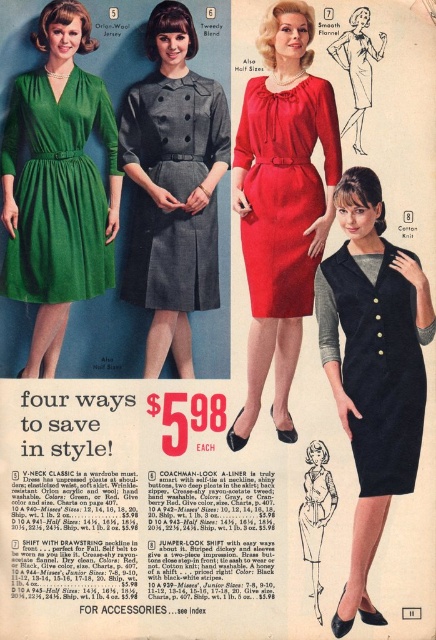
In the vintage fashion advertisement, there are two points marked at coordinates point (17,180) and point (333,506). Which point is positioned closer to the viewer?

Point (17,180) is closer to the viewer than point (333,506).

You are a fashion designer trying to decide which dress to feature in a new collection. The twilly blend wool dress at center and the black wool dress at center are both candidates. Based on their widths, which one would you choose if you want a more voluminous silhouette?

The twilly blend wool dress at center is wider than the black wool dress at center, so it would be the better choice for a more voluminous silhouette.

Which dress is positioned to the left of the point at coordinates (57, 189)?

The green wool jersey dress at left is positioned to the left of the point at coordinates (57, 189).